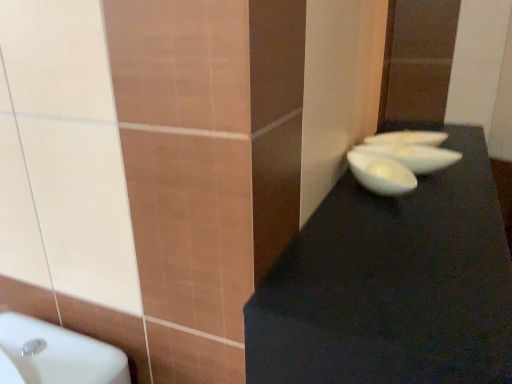
Question: Considering the relative sizes of white glossy bowl at center, the first basin viewed from the front, and white glossy bowl at center right in the image provided, is white glossy bowl at center, the first basin viewed from the front, shorter than white glossy bowl at center right?

Choices:
 (A) yes
 (B) no

Answer: (A)

Question: Is the depth of white glossy bowl at center, the 2th basin in the back-to-front sequence, greater than that of white glossy bowl at center right?

Choices:
 (A) no
 (B) yes

Answer: (B)

Question: Is white glossy bowl at center, the 2th basin in the back-to-front sequence, at the right side of white glossy bowl at center right?

Choices:
 (A) yes
 (B) no

Answer: (A)

Question: From the image's perspective, is white glossy bowl at center, the 2th basin in the back-to-front sequence, on top of white glossy bowl at center right?

Choices:
 (A) yes
 (B) no

Answer: (A)

Question: Can you confirm if white glossy bowl at center, the 2th basin in the back-to-front sequence, is taller than white glossy bowl at center right?

Choices:
 (A) yes
 (B) no

Answer: (B)

Question: From the image's perspective, is white glossy bowl at upper right, the second basin in the front-to-back sequence, located above or below black matte table at right?

Choices:
 (A) above
 (B) below

Answer: (A)

Question: From a real-world perspective, is white glossy bowl at upper right, the second basin in the front-to-back sequence, above or below black matte table at right?

Choices:
 (A) above
 (B) below

Answer: (A)

Question: Is white glossy bowl at upper right, the second basin in the front-to-back sequence, taller or shorter than black matte table at right?

Choices:
 (A) tall
 (B) short

Answer: (B)

Question: Is white glossy bowl at upper right, positioned as the first basin in back-to-front order, wider or thinner than black matte table at right?

Choices:
 (A) thin
 (B) wide

Answer: (A)

Question: Is point (436, 162) closer or farther from the camera than point (357, 150)?

Choices:
 (A) closer
 (B) farther

Answer: (B)

Question: In terms of height, does white glossy bowl at center, the first basin viewed from the front, look taller or shorter compared to white glossy bowl at center right?

Choices:
 (A) short
 (B) tall

Answer: (A)

Question: Visually, is white glossy bowl at center, the 2th basin in the back-to-front sequence, positioned to the left or to the right of white glossy bowl at center right?

Choices:
 (A) right
 (B) left

Answer: (A)

Question: Choose the correct answer: Is white glossy bowl at center, the first basin viewed from the front, inside white glossy bowl at center right or outside it?

Choices:
 (A) inside
 (B) outside

Answer: (B)

Question: From their relative heights in the image, would you say white glossy bowl at center right is taller or shorter than white glossy bowl at center, the first basin viewed from the front?

Choices:
 (A) short
 (B) tall

Answer: (B)

Question: Looking at the image, does white glossy bowl at center right seem bigger or smaller compared to white glossy bowl at center, the 2th basin in the back-to-front sequence?

Choices:
 (A) small
 (B) big

Answer: (B)